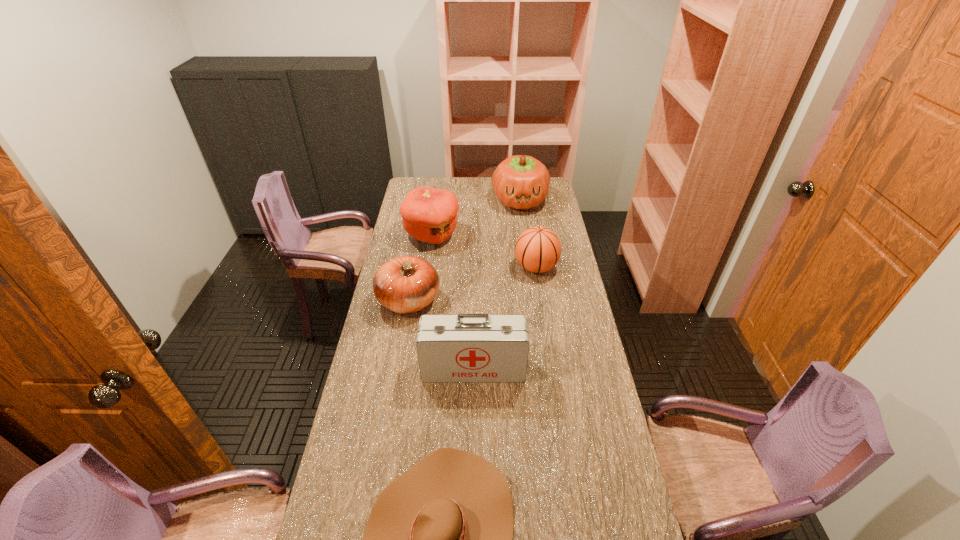
Where is `free space between the fifth farthest object and the fifth nearest object`? This screenshot has width=960, height=540. free space between the fifth farthest object and the fifth nearest object is located at coordinates (453, 302).

Where is `object that is the third closest to the fifth farthest object`? Image resolution: width=960 pixels, height=540 pixels. object that is the third closest to the fifth farthest object is located at coordinates (538, 249).

Locate which object ranks in proximity to the fifth farthest object. Please provide its 2D coordinates. Your answer should be formatted as a tuple, i.e. [(x, y)], where the tuple contains the x and y coordinates of a point satisfying the conditions above.

[(406, 284)]

Image resolution: width=960 pixels, height=540 pixels. In order to click on pumpkin object that ranks as the second closest to the second nearest pumpkin in this screenshot , I will do `click(406, 284)`.

The image size is (960, 540). Identify the location of the third closest pumpkin relative to the first-aid kit. (521, 182).